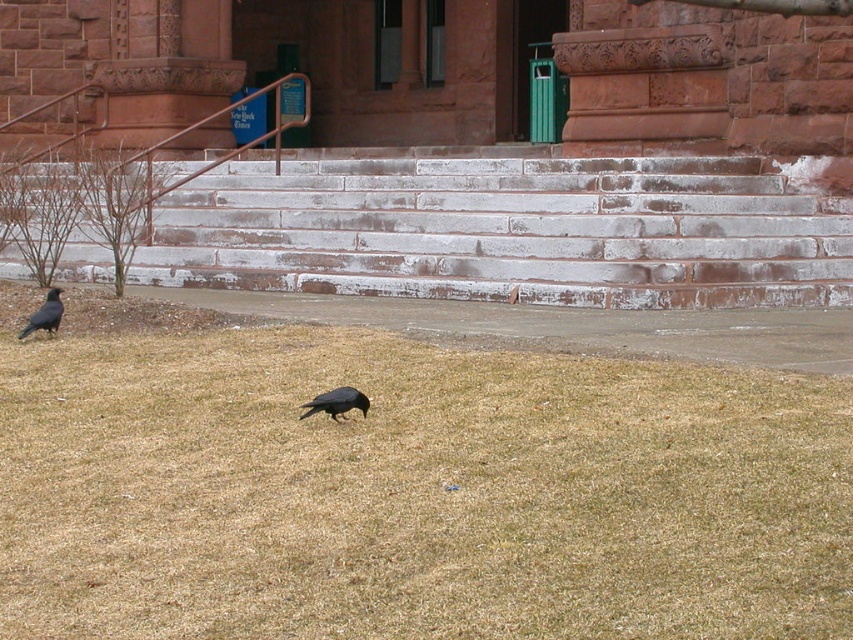
The image size is (853, 640). What do you see at coordinates (405, 486) in the screenshot?
I see `brown dry grass at lower center` at bounding box center [405, 486].

Is brown dry grass at lower center to the left of matte black bird at lower left from the viewer's perspective?

In fact, brown dry grass at lower center is to the right of matte black bird at lower left.

Between point (238, 406) and point (45, 305), which one is positioned in front?

Point (238, 406) is in front.

I want to click on brown dry grass at lower center, so click(x=405, y=486).

Between brown dry grass at lower center and white stone stairs at center, which one appears on the right side from the viewer's perspective?

From the viewer's perspective, brown dry grass at lower center appears more on the right side.

What do you see at coordinates (405, 486) in the screenshot? The image size is (853, 640). I see `brown dry grass at lower center` at bounding box center [405, 486].

Who is more forward, (x=137, y=584) or (x=289, y=173)?

Positioned in front is point (x=137, y=584).

Where is `brown dry grass at lower center`? brown dry grass at lower center is located at coordinates (405, 486).

Is white stone stairs at center to the left of matte black bird at lower left from the viewer's perspective?

In fact, white stone stairs at center is to the right of matte black bird at lower left.

Is point (322, 241) closer to viewer compared to point (16, 333)?

No.

The image size is (853, 640). I want to click on white stone stairs at center, so click(x=506, y=228).